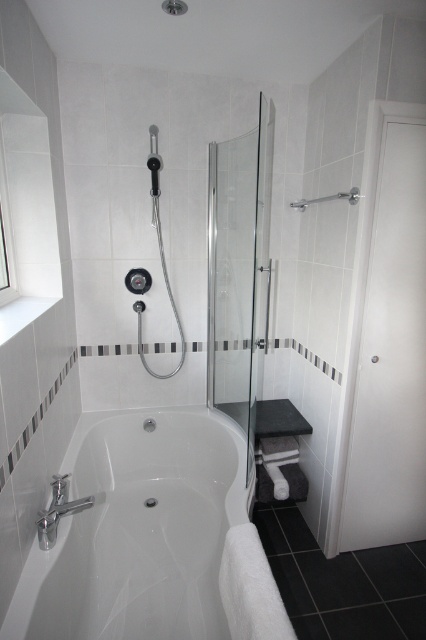
Is white matte door at right to the right of transparent glass shower door at center from the viewer's perspective?

Indeed, white matte door at right is positioned on the right side of transparent glass shower door at center.

Does white matte door at right have a lesser height compared to transparent glass shower door at center?

No.

Does point (402, 445) come in front of point (235, 198)?

Yes, point (402, 445) is closer to viewer.

Locate an element on the screen. white matte door at right is located at coordinates (391, 356).

Is white matte door at right positioned at the back of silver metallic towel bar at upper right?

No, it is not.

Can you confirm if white matte door at right is positioned to the right of silver metallic towel bar at upper right?

Indeed, white matte door at right is positioned on the right side of silver metallic towel bar at upper right.

Which is in front, point (420, 172) or point (299, 205)?

Point (420, 172) is more forward.

You are a GUI agent. You are given a task and a screenshot of the screen. Output one action in this format:
    pyautogui.click(x=<x>, y=<y>)
    Task: Click on the white matte door at right
    
    Given the screenshot: What is the action you would take?
    pyautogui.click(x=391, y=356)

Does white glossy bathtub at lower left have a smaller size compared to white matte door at right?

No.

Who is more distant from viewer, (192, 531) or (380, 472)?

The point (192, 531) is more distant.

Which is in front, point (209, 438) or point (402, 324)?

Positioned in front is point (402, 324).

Where is `white glossy bathtub at lower left`? This screenshot has width=426, height=640. white glossy bathtub at lower left is located at coordinates (152, 538).